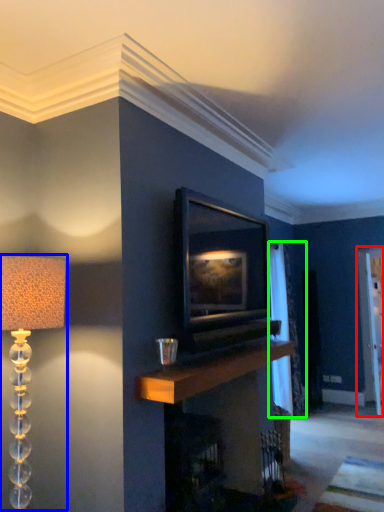
Question: Which object is positioned farthest from glass door (highlighted by a red box)? Select from lamp (highlighted by a blue box) and curtain (highlighted by a green box).

Choices:
 (A) lamp
 (B) curtain

Answer: (A)